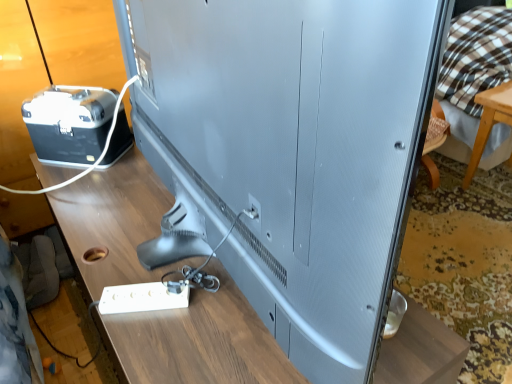
Question: Is brown checkered fabric at upper right shorter than white plastic wire at left?

Choices:
 (A) no
 (B) yes

Answer: (A)

Question: Is brown checkered fabric at upper right in contact with white plastic wire at left?

Choices:
 (A) no
 (B) yes

Answer: (A)

Question: Is white plastic wire at left a part of brown checkered fabric at upper right?

Choices:
 (A) yes
 (B) no

Answer: (B)

Question: Considering the relative positions of brown checkered fabric at upper right and white plastic wire at left in the image provided, is brown checkered fabric at upper right to the right of white plastic wire at left from the viewer's perspective?

Choices:
 (A) no
 (B) yes

Answer: (B)

Question: Can you confirm if brown checkered fabric at upper right is smaller than white plastic wire at left?

Choices:
 (A) yes
 (B) no

Answer: (B)

Question: In the image, is brown checkered fabric at upper right positioned in front of or behind white plastic extension cord at lower left?

Choices:
 (A) behind
 (B) front

Answer: (A)

Question: Is brown checkered fabric at upper right wider or thinner than white plastic extension cord at lower left?

Choices:
 (A) wide
 (B) thin

Answer: (A)

Question: Looking at the image, does brown checkered fabric at upper right seem bigger or smaller compared to white plastic extension cord at lower left?

Choices:
 (A) small
 (B) big

Answer: (B)

Question: Considering the positions of brown checkered fabric at upper right and white plastic extension cord at lower left in the image, is brown checkered fabric at upper right taller or shorter than white plastic extension cord at lower left?

Choices:
 (A) tall
 (B) short

Answer: (A)

Question: In terms of width, does wooden table at center look wider or thinner when compared to white plastic extension cord at lower left?

Choices:
 (A) wide
 (B) thin

Answer: (A)

Question: Looking at the image, does wooden table at center seem bigger or smaller compared to white plastic extension cord at lower left?

Choices:
 (A) small
 (B) big

Answer: (B)

Question: From the image's perspective, relative to white plastic extension cord at lower left, is wooden table at center above or below?

Choices:
 (A) above
 (B) below

Answer: (B)

Question: Considering the positions of point (41, 183) and point (180, 281), is point (41, 183) closer or farther from the camera than point (180, 281)?

Choices:
 (A) farther
 (B) closer

Answer: (A)

Question: Is white plastic extension cord at lower left situated inside wooden table at center or outside?

Choices:
 (A) inside
 (B) outside

Answer: (A)

Question: From a real-world perspective, relative to wooden table at center, is white plastic extension cord at lower left vertically above or below?

Choices:
 (A) above
 (B) below

Answer: (A)